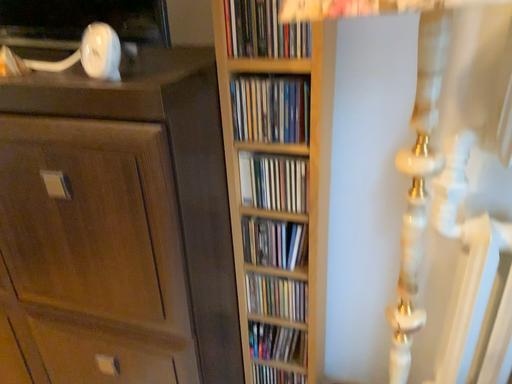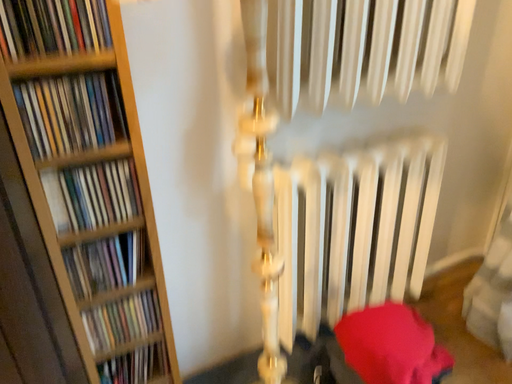
Question: How did the camera likely rotate when shooting the video?

Choices:
 (A) rotated left
 (B) rotated right

Answer: (B)